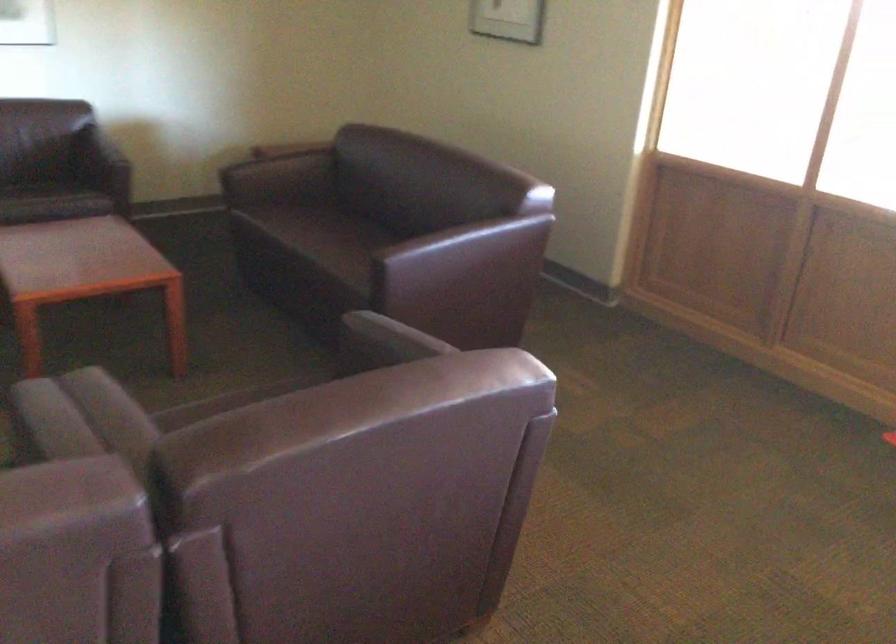
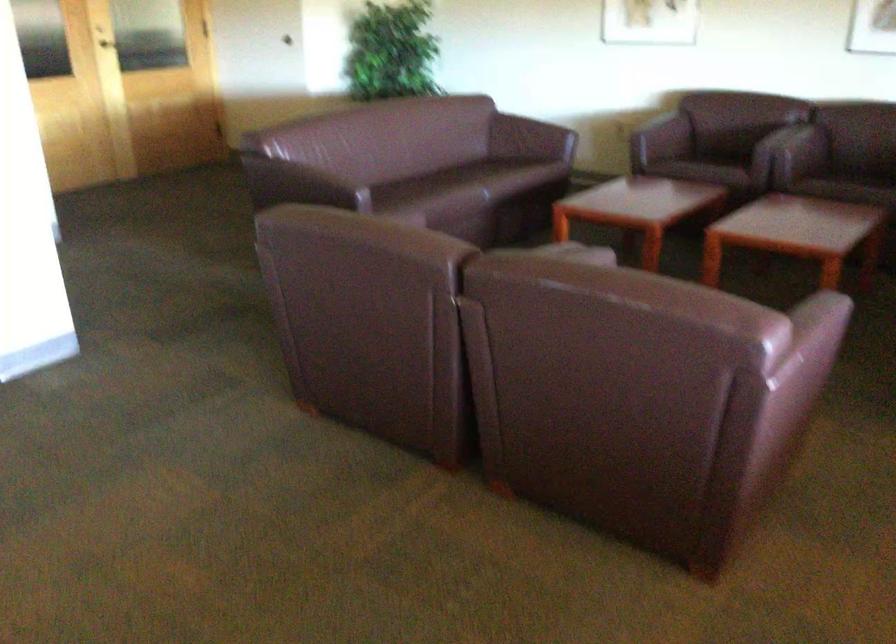
Locate, in the second image, the point that corresponds to (x=435, y=346) in the first image.

(821, 325)